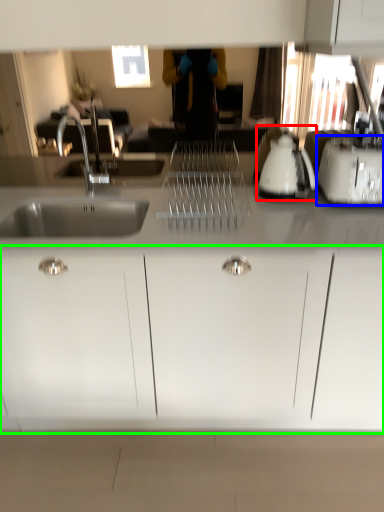
Question: Which object is positioned closest to appliance (highlighted by a red box)? Select from toaster (highlighted by a blue box) and cabinetry (highlighted by a green box).

Choices:
 (A) toaster
 (B) cabinetry

Answer: (A)